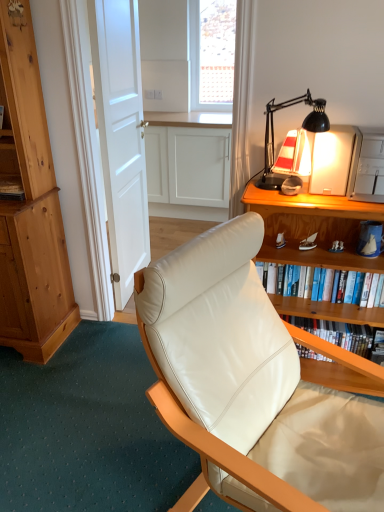
Question: Is white leather chair at center surrounded by hardcover book at right, which is the second book from bottom to top?

Choices:
 (A) no
 (B) yes

Answer: (A)

Question: Is hardcover book at right, the 1th book positioned from the top, oriented towards white leather chair at center?

Choices:
 (A) no
 (B) yes

Answer: (B)

Question: Is hardcover book at right, the 1th book positioned from the top, bigger than white leather chair at center?

Choices:
 (A) no
 (B) yes

Answer: (A)

Question: From a real-world perspective, is hardcover book at right, which is the second book from bottom to top, below white leather chair at center?

Choices:
 (A) yes
 (B) no

Answer: (B)

Question: From the image's perspective, would you say hardcover book at right, the 1th book positioned from the top, is shown under white leather chair at center?

Choices:
 (A) yes
 (B) no

Answer: (B)

Question: Based on their sizes in the image, would you say hardcover book at center, positioned as the second book in top-to-bottom order, is bigger or smaller than wooden desk at right?

Choices:
 (A) small
 (B) big

Answer: (A)

Question: In the image, is hardcover book at center, arranged as the first book when ordered from the bottom, on the left side or the right side of wooden desk at right?

Choices:
 (A) right
 (B) left

Answer: (A)

Question: Considering the positions of hardcover book at center, positioned as the second book in top-to-bottom order, and wooden desk at right in the image, is hardcover book at center, positioned as the second book in top-to-bottom order, wider or thinner than wooden desk at right?

Choices:
 (A) wide
 (B) thin

Answer: (B)

Question: Considering their positions, is hardcover book at center, positioned as the second book in top-to-bottom order, located in front of or behind wooden desk at right?

Choices:
 (A) behind
 (B) front

Answer: (A)

Question: Would you say hardcover book at center, positioned as the second book in top-to-bottom order, is inside or outside white matte door at center?

Choices:
 (A) inside
 (B) outside

Answer: (B)

Question: From the image's perspective, relative to white matte door at center, is hardcover book at center, positioned as the second book in top-to-bottom order, above or below?

Choices:
 (A) above
 (B) below

Answer: (B)

Question: Looking at their shapes, would you say hardcover book at center, arranged as the first book when ordered from the bottom, is wider or thinner than white matte door at center?

Choices:
 (A) thin
 (B) wide

Answer: (B)

Question: Considering their positions, is hardcover book at center, positioned as the second book in top-to-bottom order, located in front of or behind white matte door at center?

Choices:
 (A) behind
 (B) front

Answer: (A)

Question: Is wooden desk at right bigger or smaller than black matte desk lamp at upper right?

Choices:
 (A) small
 (B) big

Answer: (B)

Question: Considering the positions of wooden desk at right and black matte desk lamp at upper right in the image, is wooden desk at right taller or shorter than black matte desk lamp at upper right?

Choices:
 (A) tall
 (B) short

Answer: (A)